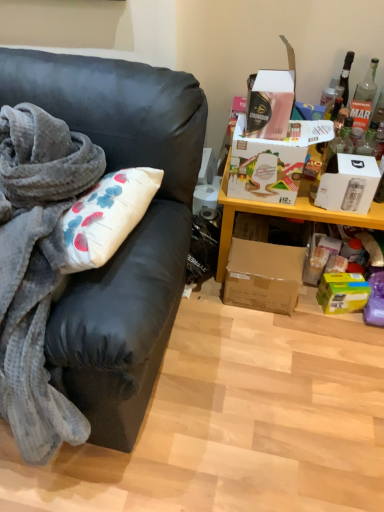
Image resolution: width=384 pixels, height=512 pixels. Describe the element at coordinates (129, 234) in the screenshot. I see `matte black couch at left` at that location.

The height and width of the screenshot is (512, 384). What are the coordinates of `white cardboard box at upper right, which is counted as the first box, starting from the top` in the screenshot? It's located at (273, 161).

What is the approximate height of green matte box at lower right, which is the 4th box in top-to-bottom order?

green matte box at lower right, which is the 4th box in top-to-bottom order, is 5.60 inches in height.

How much space does brown cardboard box at lower right, acting as the second box starting from the bottom, occupy horizontally?

39.96 centimeters.

I want to click on matte black couch at left, so click(x=129, y=234).

From the image's perspective, does brown cardboard box at lower right, acting as the second box starting from the bottom, appear higher than green matte box at lower right, which ranks as the 1th box in bottom-to-top order?

Indeed, from the image's perspective, brown cardboard box at lower right, acting as the second box starting from the bottom, is shown above green matte box at lower right, which ranks as the 1th box in bottom-to-top order.

Is brown cardboard box at lower right, acting as the second box starting from the bottom, bigger or smaller than green matte box at lower right, which ranks as the 1th box in bottom-to-top order?

brown cardboard box at lower right, acting as the second box starting from the bottom, is bigger than green matte box at lower right, which ranks as the 1th box in bottom-to-top order.

Is brown cardboard box at lower right, acting as the second box starting from the bottom, positioned far away from green matte box at lower right, which ranks as the 1th box in bottom-to-top order?

No, there isn't a large distance between brown cardboard box at lower right, acting as the second box starting from the bottom, and green matte box at lower right, which ranks as the 1th box in bottom-to-top order.

How different are the orientations of brown cardboard box at lower right, the third box when ordered from top to bottom, and green matte box at lower right, which ranks as the 1th box in bottom-to-top order, in degrees?

The angle between the facing direction of brown cardboard box at lower right, the third box when ordered from top to bottom, and the facing direction of green matte box at lower right, which ranks as the 1th box in bottom-to-top order, is 16.8 degrees.

Who is bigger, green matte box at lower right, which is the 4th box in top-to-bottom order, or white cardboard box at right, placed as the 2th box when sorted from top to bottom?

white cardboard box at right, placed as the 2th box when sorted from top to bottom.

Is green matte box at lower right, which ranks as the 1th box in bottom-to-top order, beside white cardboard box at right, placed as the 2th box when sorted from top to bottom?

green matte box at lower right, which ranks as the 1th box in bottom-to-top order, is not next to white cardboard box at right, placed as the 2th box when sorted from top to bottom, and they're not touching.

Could you tell me if green matte box at lower right, which is the 4th box in top-to-bottom order, is turned towards white cardboard box at right, placed as the 2th box when sorted from top to bottom?

No, green matte box at lower right, which is the 4th box in top-to-bottom order, is not turned towards white cardboard box at right, placed as the 2th box when sorted from top to bottom.

From the picture: Who is smaller, brown cardboard box at lower right, the third box when ordered from top to bottom, or yellow wood shelf at upper right?

brown cardboard box at lower right, the third box when ordered from top to bottom.

Which is less distant, (232, 286) or (310, 217)?

Point (232, 286) is farther from the camera than point (310, 217).

How different are the orientations of brown cardboard box at lower right, acting as the second box starting from the bottom, and yellow wood shelf at upper right in degrees?

brown cardboard box at lower right, acting as the second box starting from the bottom, and yellow wood shelf at upper right are facing 0.00015 degrees away from each other.

Is brown cardboard box at lower right, the third box when ordered from top to bottom, positioned beyond the bounds of yellow wood shelf at upper right?

No, most part of brown cardboard box at lower right, the third box when ordered from top to bottom, lies within yellow wood shelf at upper right.

From a real-world perspective, who is located lower, white cardboard box at upper right, which is the 4th box from bottom to top, or white cardboard box at right, placed as the 2th box when sorted from top to bottom?

In real-world perspective, white cardboard box at upper right, which is the 4th box from bottom to top, is lower.

Is white cardboard box at upper right, which is the 4th box from bottom to top, positioned with its back to white cardboard box at right, placed as the 2th box when sorted from top to bottom?

No, white cardboard box at right, placed as the 2th box when sorted from top to bottom, is not at the back of white cardboard box at upper right, which is the 4th box from bottom to top.

Is white cardboard box at upper right, which is the 4th box from bottom to top, next to white cardboard box at right, placed as the 2th box when sorted from top to bottom, and touching it?

There is a gap between white cardboard box at upper right, which is the 4th box from bottom to top, and white cardboard box at right, placed as the 2th box when sorted from top to bottom.

Does white cardboard box at upper right, which is the 4th box from bottom to top, have a larger size compared to white cardboard box at right, the 3th box in the bottom-to-top sequence?

Correct, white cardboard box at upper right, which is the 4th box from bottom to top, is larger in size than white cardboard box at right, the 3th box in the bottom-to-top sequence.

Image resolution: width=384 pixels, height=512 pixels. Identify the location of the 1st box positioned below the white cardboard box at right, the 3th box in the bottom-to-top sequence (from the image's perspective). (266, 263).

From a real-world perspective, who is located higher, brown cardboard box at lower right, the third box when ordered from top to bottom, or white cardboard box at right, the 3th box in the bottom-to-top sequence?

From a 3D spatial view, white cardboard box at right, the 3th box in the bottom-to-top sequence, is above.

Is brown cardboard box at lower right, the third box when ordered from top to bottom, far from white cardboard box at right, placed as the 2th box when sorted from top to bottom?

No, brown cardboard box at lower right, the third box when ordered from top to bottom, is not far from white cardboard box at right, placed as the 2th box when sorted from top to bottom.

Does brown cardboard box at lower right, acting as the second box starting from the bottom, appear on the right side of white cardboard box at right, placed as the 2th box when sorted from top to bottom?

In fact, brown cardboard box at lower right, acting as the second box starting from the bottom, is to the left of white cardboard box at right, placed as the 2th box when sorted from top to bottom.

Which of these two, brown cardboard box at lower right, the third box when ordered from top to bottom, or matte black couch at left, is thinner?

With smaller width is brown cardboard box at lower right, the third box when ordered from top to bottom.

From the image's perspective, is brown cardboard box at lower right, acting as the second box starting from the bottom, located above or below matte black couch at left?

From the image's perspective, brown cardboard box at lower right, acting as the second box starting from the bottom, appears below matte black couch at left.

Where is `box that is the 1st one below the matte black couch at left (from a real-world perspective)`? box that is the 1st one below the matte black couch at left (from a real-world perspective) is located at coordinates (266, 263).

Is brown cardboard box at lower right, the third box when ordered from top to bottom, bigger or smaller than matte black couch at left?

In the image, brown cardboard box at lower right, the third box when ordered from top to bottom, appears to be smaller than matte black couch at left.

Can you confirm if matte black couch at left is bigger than white cardboard box at right, the 3th box in the bottom-to-top sequence?

Indeed, matte black couch at left has a larger size compared to white cardboard box at right, the 3th box in the bottom-to-top sequence.

Would you say matte black couch at left contains white cardboard box at right, placed as the 2th box when sorted from top to bottom?

Definitely not — white cardboard box at right, placed as the 2th box when sorted from top to bottom, is not inside matte black couch at left.

The height and width of the screenshot is (512, 384). I want to click on the 1st box behind the matte black couch at left, so click(348, 183).

Are matte black couch at left and white cardboard box at right, placed as the 2th box when sorted from top to bottom, located far from each other?

No, matte black couch at left is in close proximity to white cardboard box at right, placed as the 2th box when sorted from top to bottom.

Locate an element on the screen. The width and height of the screenshot is (384, 512). the 2nd box to the left when counting from the green matte box at lower right, which is the 4th box in top-to-bottom order is located at coordinates (266, 263).

From a real-world perspective, starting from the green matte box at lower right, which is the 4th box in top-to-bottom order, which box is the 3rd one vertically above it? Please provide its 2D coordinates.

[(348, 183)]

Consider the image. Which object lies further to the anchor point matte black couch at left, yellow wood shelf at upper right or brown cardboard box at lower right, acting as the second box starting from the bottom?

brown cardboard box at lower right, acting as the second box starting from the bottom, lies further to matte black couch at left than the other object.

Looking at the image, which one is located closer to yellow wood shelf at upper right, white cardboard box at upper right, which is counted as the first box, starting from the top, or green matte box at lower right, which is the 4th box in top-to-bottom order?

Based on the image, white cardboard box at upper right, which is counted as the first box, starting from the top, appears to be nearer to yellow wood shelf at upper right.

Based on their spatial positions, is white cardboard box at right, placed as the 2th box when sorted from top to bottom, or brown cardboard box at lower right, acting as the second box starting from the bottom, further from white cardboard box at upper right, which is the 4th box from bottom to top?

Among the two, brown cardboard box at lower right, acting as the second box starting from the bottom, is located further to white cardboard box at upper right, which is the 4th box from bottom to top.

Which object lies further to the anchor point green matte box at lower right, which is the 4th box in top-to-bottom order, white cardboard box at upper right, which is the 4th box from bottom to top, or white cardboard box at right, placed as the 2th box when sorted from top to bottom?

white cardboard box at upper right, which is the 4th box from bottom to top.

When comparing their distances from brown cardboard box at lower right, the third box when ordered from top to bottom, does white cardboard box at right, the 3th box in the bottom-to-top sequence, or white cardboard box at upper right, which is the 4th box from bottom to top, seem further?

Among the two, white cardboard box at right, the 3th box in the bottom-to-top sequence, is located further to brown cardboard box at lower right, the third box when ordered from top to bottom.

Estimate the real-world distances between objects in this image. Which object is closer to brown cardboard box at lower right, acting as the second box starting from the bottom, white cardboard box at right, placed as the 2th box when sorted from top to bottom, or green matte box at lower right, which ranks as the 1th box in bottom-to-top order?

green matte box at lower right, which ranks as the 1th box in bottom-to-top order, is positioned closer to the anchor brown cardboard box at lower right, acting as the second box starting from the bottom.

From the image, which object appears to be farther from white cardboard box at right, placed as the 2th box when sorted from top to bottom, white cardboard box at upper right, which is the 4th box from bottom to top, or brown cardboard box at lower right, acting as the second box starting from the bottom?

Based on the image, brown cardboard box at lower right, acting as the second box starting from the bottom, appears to be further to white cardboard box at right, placed as the 2th box when sorted from top to bottom.

When comparing their distances from brown cardboard box at lower right, acting as the second box starting from the bottom, does white cardboard box at upper right, which is the 4th box from bottom to top, or yellow wood shelf at upper right seem further?

Based on the image, white cardboard box at upper right, which is the 4th box from bottom to top, appears to be further to brown cardboard box at lower right, acting as the second box starting from the bottom.

At what (x,y) coordinates should I click in order to perform the action: click on box between matte black couch at left and brown cardboard box at lower right, the third box when ordered from top to bottom. Please return your answer as a coordinate pair (x, y). Image resolution: width=384 pixels, height=512 pixels. Looking at the image, I should click on (273, 161).

At what (x,y) coordinates should I click in order to perform the action: click on box between white cardboard box at right, the 3th box in the bottom-to-top sequence, and green matte box at lower right, which is the 4th box in top-to-bottom order, in the vertical direction. Please return your answer as a coordinate pair (x, y). The height and width of the screenshot is (512, 384). Looking at the image, I should click on (266, 263).

The height and width of the screenshot is (512, 384). What are the coordinates of `cabinetry between matte black couch at left and green matte box at lower right, which is the 4th box in top-to-bottom order, from left to right` in the screenshot? It's located at (284, 215).

The width and height of the screenshot is (384, 512). In order to click on cabinetry between white cardboard box at upper right, which is the 4th box from bottom to top, and green matte box at lower right, which is the 4th box in top-to-bottom order, vertically in this screenshot , I will do `click(284, 215)`.